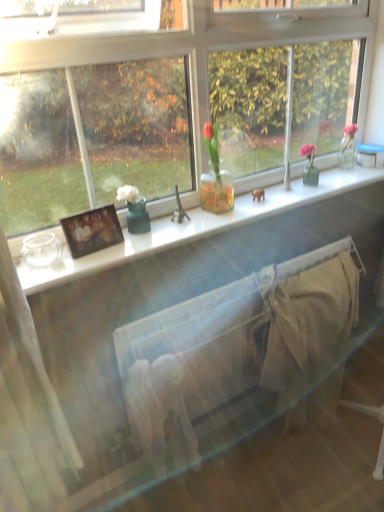
You are a GUI agent. You are given a task and a screenshot of the screen. Output one action in this format:
    pyautogui.click(x=<x>, y=<y>)
    Task: Click on the beige cotton blanket at lower right
    
    Given the screenshot: What is the action you would take?
    pyautogui.click(x=311, y=337)

You are a GUI agent. You are given a task and a screenshot of the screen. Output one action in this format:
    pyautogui.click(x=<x>, y=<y>)
    Task: Click on the white glossy window sill at center
    The height and width of the screenshot is (512, 384).
    Given the screenshot: What is the action you would take?
    pyautogui.click(x=193, y=227)

Is matte wooden picture frame at left to the left or to the right of white fabric bed frame at center in the image?

In the image, matte wooden picture frame at left appears on the left side of white fabric bed frame at center.

Is white fabric bed frame at center surrounded by matte wooden picture frame at left?

No.

Is matte wooden picture frame at left beside white fabric bed frame at center?

No, matte wooden picture frame at left is not beside white fabric bed frame at center.

Can you confirm if matte wooden picture frame at left is bigger than white fabric bed frame at center?

No.

Does white fabric bed frame at center appear on the left side of white glossy window sill at center?

No.

From the image's perspective, does white fabric bed frame at center appear higher than white glossy window sill at center?

No, from the image's perspective, white fabric bed frame at center is not over white glossy window sill at center.

From a real-world perspective, is white fabric bed frame at center positioned above or below white glossy window sill at center?

white fabric bed frame at center is situated lower than white glossy window sill at center in the real world.

Does white fabric bed frame at center have a larger size compared to white glossy window sill at center?

Yes.

From a real-world perspective, is matte wooden picture frame at left located higher than white glossy window sill at center?

Yes, from a real-world perspective, matte wooden picture frame at left is above white glossy window sill at center.

Could you tell me if matte wooden picture frame at left is turned towards white glossy window sill at center?

No, matte wooden picture frame at left is not oriented towards white glossy window sill at center.

Is matte wooden picture frame at left wider or thinner than white glossy window sill at center?

matte wooden picture frame at left is thinner than white glossy window sill at center.

Identify the location of bed frame that appears behind the white glossy window sill at center. Image resolution: width=384 pixels, height=512 pixels. (239, 348).

Is white glossy window sill at center far from white fabric bed frame at center?

No, white glossy window sill at center is in close proximity to white fabric bed frame at center.

Considering the relative positions of white glossy window sill at center and white fabric bed frame at center in the image provided, is white glossy window sill at center to the right of white fabric bed frame at center from the viewer's perspective?

No, white glossy window sill at center is not to the right of white fabric bed frame at center.

Is white glossy window sill at center wider than beige cotton blanket at lower right?

No, white glossy window sill at center is not wider than beige cotton blanket at lower right.

Considering the positions of objects white glossy window sill at center and beige cotton blanket at lower right in the image provided, who is behind, white glossy window sill at center or beige cotton blanket at lower right?

beige cotton blanket at lower right is further from the camera.

Does white glossy window sill at center contain beige cotton blanket at lower right?

No, beige cotton blanket at lower right is not inside white glossy window sill at center.

Between point (280, 207) and point (303, 308), which one is positioned behind?

The point (303, 308) is behind.

Considering the sizes of white fabric bed frame at center and matte wooden picture frame at left in the image, is white fabric bed frame at center wider or thinner than matte wooden picture frame at left?

Clearly, white fabric bed frame at center has more width compared to matte wooden picture frame at left.

From a real-world perspective, is white fabric bed frame at center above or below matte wooden picture frame at left?

white fabric bed frame at center is situated lower than matte wooden picture frame at left in the real world.

How much distance is there between white fabric bed frame at center and matte wooden picture frame at left?

white fabric bed frame at center and matte wooden picture frame at left are 24.00 inches apart from each other.

Which is closer to the camera, (x=196, y=316) or (x=60, y=220)?

Point (x=60, y=220)

Can you see matte wooden picture frame at left touching beige cotton blanket at lower right?

Result: No, matte wooden picture frame at left is not beside beige cotton blanket at lower right.

Is point (93, 223) closer or farther from the camera than point (337, 379)?

Point (93, 223) is positioned closer to the camera compared to point (337, 379).

Is matte wooden picture frame at left bigger or smaller than beige cotton blanket at lower right?

Considering their sizes, matte wooden picture frame at left takes up less space than beige cotton blanket at lower right.

This screenshot has height=512, width=384. In order to click on bed frame below the matte wooden picture frame at left (from the image's perspective) in this screenshot , I will do `click(239, 348)`.

The height and width of the screenshot is (512, 384). I want to click on bed frame on the right of white glossy window sill at center, so click(239, 348).

Looking at the image, which one is located further to white glossy window sill at center, matte wooden picture frame at left or beige cotton blanket at lower right?

beige cotton blanket at lower right is positioned further to the anchor white glossy window sill at center.

When comparing their distances from white glossy window sill at center, does white fabric bed frame at center or beige cotton blanket at lower right seem further?

Among the two, beige cotton blanket at lower right is located further to white glossy window sill at center.

Based on their spatial positions, is matte wooden picture frame at left or white fabric bed frame at center further from white glossy window sill at center?

white fabric bed frame at center.

Based on their spatial positions, is white glossy window sill at center or matte wooden picture frame at left further from beige cotton blanket at lower right?

Among the two, matte wooden picture frame at left is located further to beige cotton blanket at lower right.

Looking at the image, which one is located further to beige cotton blanket at lower right, matte wooden picture frame at left or white glossy window sill at center?

Based on the image, matte wooden picture frame at left appears to be further to beige cotton blanket at lower right.

From the image, which object appears to be nearer to white fabric bed frame at center, beige cotton blanket at lower right or white glossy window sill at center?

beige cotton blanket at lower right lies closer to white fabric bed frame at center than the other object.

Which object lies further to the anchor point white fabric bed frame at center, white glossy window sill at center or beige cotton blanket at lower right?

white glossy window sill at center lies further to white fabric bed frame at center than the other object.

When comparing their distances from matte wooden picture frame at left, does beige cotton blanket at lower right or white glossy window sill at center seem further?

beige cotton blanket at lower right lies further to matte wooden picture frame at left than the other object.

The width and height of the screenshot is (384, 512). Identify the location of window sill between matte wooden picture frame at left and white fabric bed frame at center in the horizontal direction. (193, 227).

The image size is (384, 512). I want to click on window sill between matte wooden picture frame at left and beige cotton blanket at lower right from left to right, so click(x=193, y=227).

Where is `bed frame situated between matte wooden picture frame at left and beige cotton blanket at lower right from left to right`? The height and width of the screenshot is (512, 384). bed frame situated between matte wooden picture frame at left and beige cotton blanket at lower right from left to right is located at coordinates (239, 348).

Where is `bed frame between white glossy window sill at center and beige cotton blanket at lower right from top to bottom`? Image resolution: width=384 pixels, height=512 pixels. bed frame between white glossy window sill at center and beige cotton blanket at lower right from top to bottom is located at coordinates (239, 348).